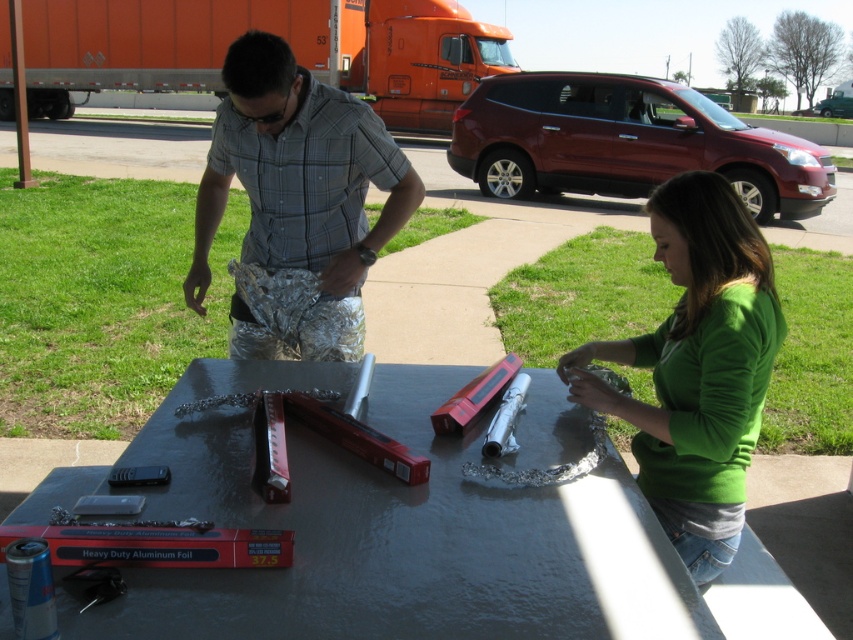
Can you confirm if metallic gray table at center is positioned to the left of green matte shirt at center?

Yes, metallic gray table at center is to the left of green matte shirt at center.

Between metallic gray table at center and green matte shirt at center, which one appears on the left side from the viewer's perspective?

Positioned to the left is metallic gray table at center.

Does point (189, 576) come farther from viewer compared to point (717, 435)?

No, it is not.

Identify the location of metallic gray table at center. The image size is (853, 640). (390, 532).

Which is more to the right, silver reflective foil at center or green matte shirt at center?

Positioned to the right is green matte shirt at center.

Can you confirm if silver reflective foil at center is shorter than green matte shirt at center?

Yes.

Image resolution: width=853 pixels, height=640 pixels. What are the coordinates of `silver reflective foil at center` in the screenshot? It's located at (296, 205).

The height and width of the screenshot is (640, 853). Find the location of `silver reflective foil at center`. silver reflective foil at center is located at coordinates (296, 205).

Locate an element on the screen. The image size is (853, 640). metallic gray table at center is located at coordinates (390, 532).

Is metallic gray table at center positioned behind silver reflective foil at center?

That is False.

Locate an element on the screen. The height and width of the screenshot is (640, 853). metallic gray table at center is located at coordinates (390, 532).